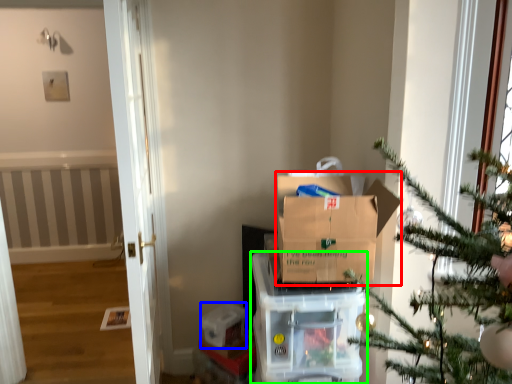
Question: Which is nearer to the cardboard box (highlighted by a red box)? storage box (highlighted by a blue box) or appliance (highlighted by a green box).

Choices:
 (A) storage box
 (B) appliance

Answer: (B)